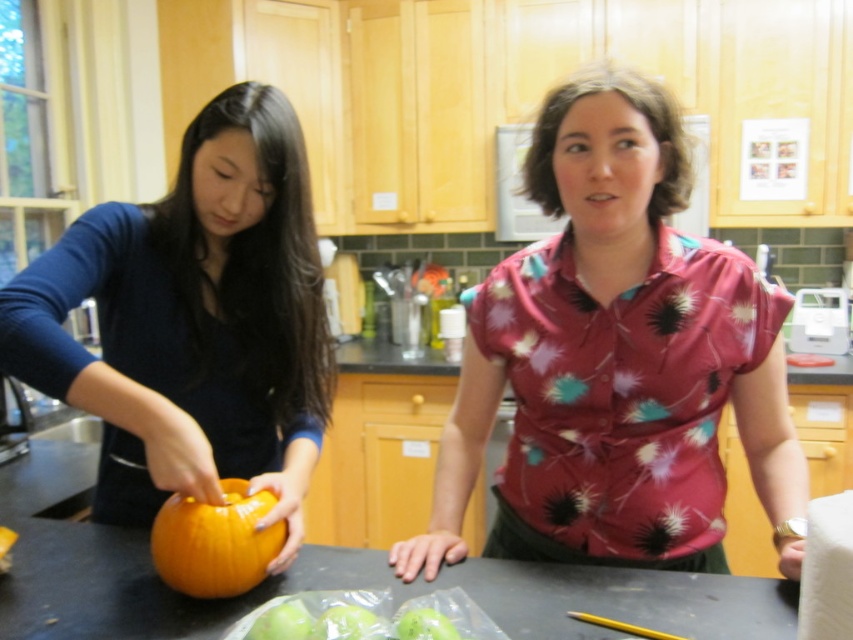
Question: Is green matte apple at lower center wider than green matte apple at center?

Choices:
 (A) no
 (B) yes

Answer: (B)

Question: Considering the real-world distances, which object is closest to the orange matte pumpkin at center?

Choices:
 (A) green matte apple at center
 (B) green matte apple at lower center
 (C) smooth orange pumpkin at center

Answer: (B)

Question: Does smooth orange pumpkin at center appear under orange matte pumpkin at center?

Choices:
 (A) no
 (B) yes

Answer: (B)

Question: Considering the relative positions of floral print blouse at center and green matte apple at lower center in the image provided, where is floral print blouse at center located with respect to green matte apple at lower center?

Choices:
 (A) left
 (B) right

Answer: (B)

Question: Which point is closer to the camera?

Choices:
 (A) orange matte pumpkin at center
 (B) floral print blouse at center

Answer: (A)

Question: Among these points, which one is nearest to the camera?

Choices:
 (A) (436, 616)
 (B) (534, 538)

Answer: (A)